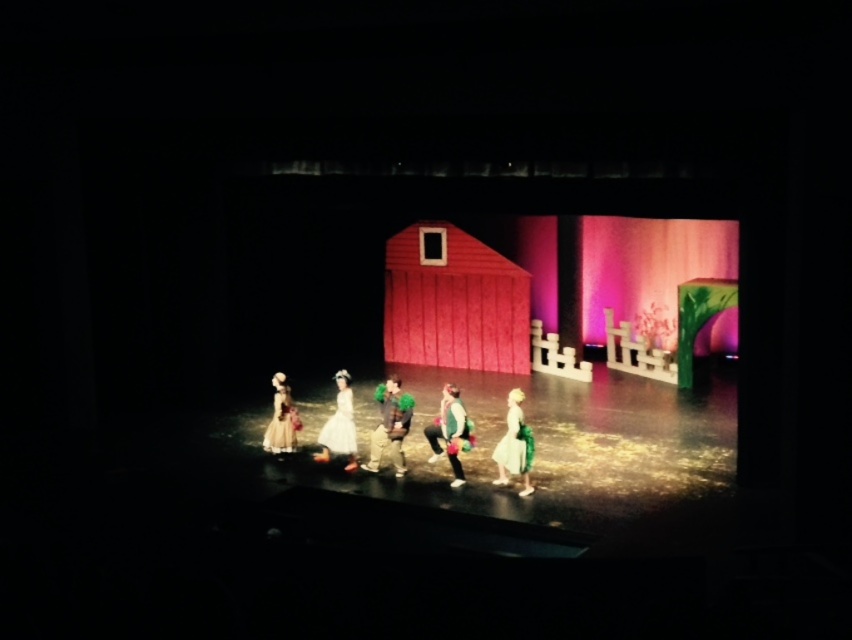
In the scene shown: Who is positioned more to the left, white satin dress at center or matte yellow dress at lower left?

Positioned to the left is matte yellow dress at lower left.

Can you confirm if white satin dress at center is bigger than matte yellow dress at lower left?

Yes.

Is point (327, 451) closer to viewer compared to point (285, 397)?

No, (327, 451) is further to viewer.

Identify the location of white satin dress at center. This screenshot has width=852, height=640. (338, 426).

Does matte white dress at center have a greater height compared to matte yellow dress at lower left?

Yes.

Which is more to the left, matte white dress at center or matte yellow dress at lower left?

matte yellow dress at lower left is more to the left.

Find the location of `matte white dress at center`. matte white dress at center is located at coordinates (514, 445).

Does green fuzzy hat at center appear on the right side of white satin dress at center?

Correct, you'll find green fuzzy hat at center to the right of white satin dress at center.

Which is in front, point (373, 429) or point (341, 419)?

Point (373, 429) is in front.

Image resolution: width=852 pixels, height=640 pixels. I want to click on green fuzzy hat at center, so click(390, 426).